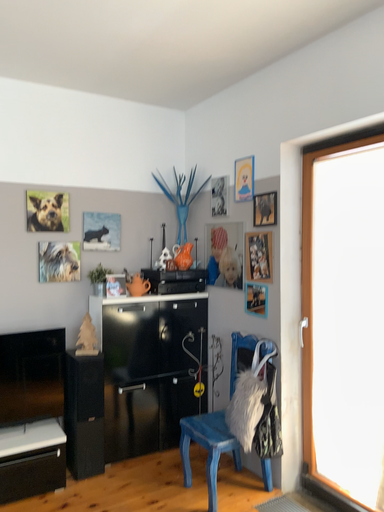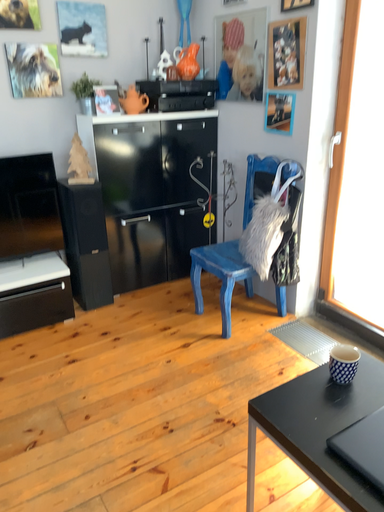
Question: How did the camera likely rotate when shooting the video?

Choices:
 (A) rotated upward
 (B) rotated downward

Answer: (B)